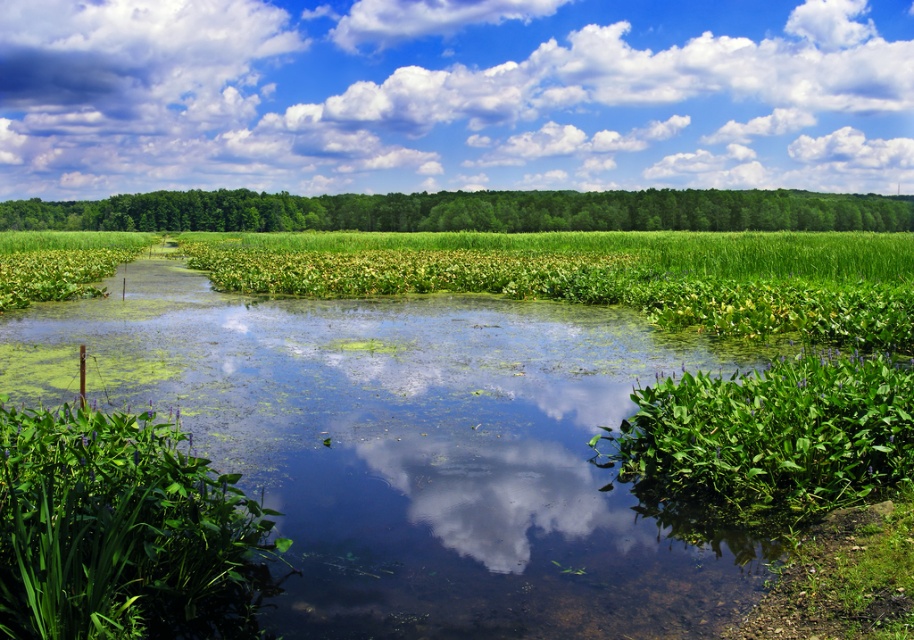
Does white fluffy cloud at upper center have a smaller size compared to green leafy plants at center?

Incorrect, white fluffy cloud at upper center is not smaller in size than green leafy plants at center.

Does white fluffy cloud at upper center lie in front of green leafy plants at center?

No.

Find the location of a particular element. The height and width of the screenshot is (640, 914). white fluffy cloud at upper center is located at coordinates (453, 96).